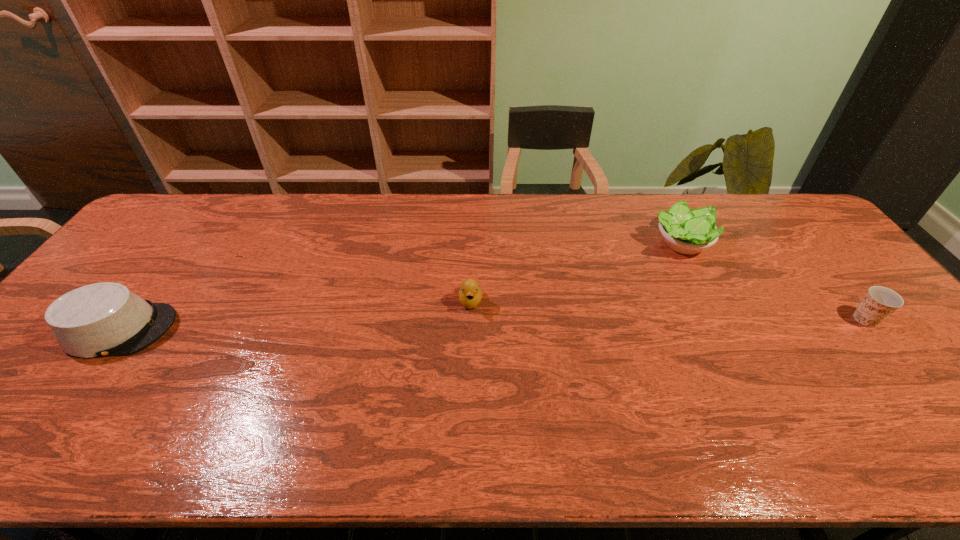
I want to click on the farthest object, so click(x=688, y=232).

At what (x,y) coordinates should I click in order to perform the action: click on lettuce. Please return your answer as a coordinate pair (x, y). Looking at the image, I should click on (688, 232).

Locate an element on the screen. The image size is (960, 540). the leftmost object is located at coordinates (105, 319).

Identify the location of the rightmost object. The image size is (960, 540). (880, 302).

Locate an element on the screen. the second object from left to right is located at coordinates (470, 294).

Where is `free space located on the back of the second object from right to left`? This screenshot has width=960, height=540. free space located on the back of the second object from right to left is located at coordinates (658, 199).

At what (x,y) coordinates should I click in order to perform the action: click on vacant space located on the front-facing side of the hat. Please return your answer as a coordinate pair (x, y). The image size is (960, 540). Looking at the image, I should click on (210, 329).

Locate an element on the screen. This screenshot has width=960, height=540. vacant area situated on the left of the Dixie cup is located at coordinates (757, 320).

At what (x,y) coordinates should I click in order to perform the action: click on free space located facing forward on the duckling. Please return your answer as a coordinate pair (x, y). The image size is (960, 540). Looking at the image, I should click on (468, 417).

Where is `object that is at the far edge`? The width and height of the screenshot is (960, 540). object that is at the far edge is located at coordinates (688, 232).